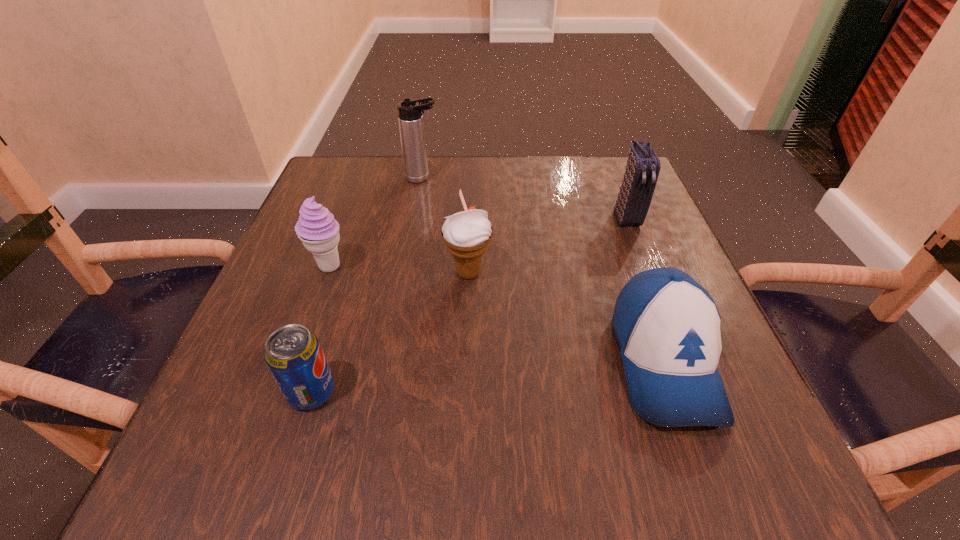
Locate an element on the screen. The height and width of the screenshot is (540, 960). object that is at the far right corner is located at coordinates (643, 166).

This screenshot has height=540, width=960. What are the coordinates of `object located at the near right corner` in the screenshot? It's located at (667, 326).

Where is `vacant area at the far edge`? This screenshot has height=540, width=960. vacant area at the far edge is located at coordinates (492, 160).

Where is `vacant area at the near edge`? This screenshot has width=960, height=540. vacant area at the near edge is located at coordinates (641, 493).

This screenshot has width=960, height=540. Identify the location of vacant space at the left edge. (357, 257).

I want to click on free space at the right edge, so click(x=647, y=266).

The image size is (960, 540). In the image, there is a desktop. Find the location of `vacant space at the far left corner`. vacant space at the far left corner is located at coordinates (357, 195).

The image size is (960, 540). Find the location of `vacant space at the near left corner of the desktop`. vacant space at the near left corner of the desktop is located at coordinates (255, 474).

Where is `vacant position at the far right corner of the desktop`? The image size is (960, 540). vacant position at the far right corner of the desktop is located at coordinates (588, 178).

Image resolution: width=960 pixels, height=540 pixels. What are the coordinates of `free space at the near right corner of the desktop` in the screenshot? It's located at (700, 464).